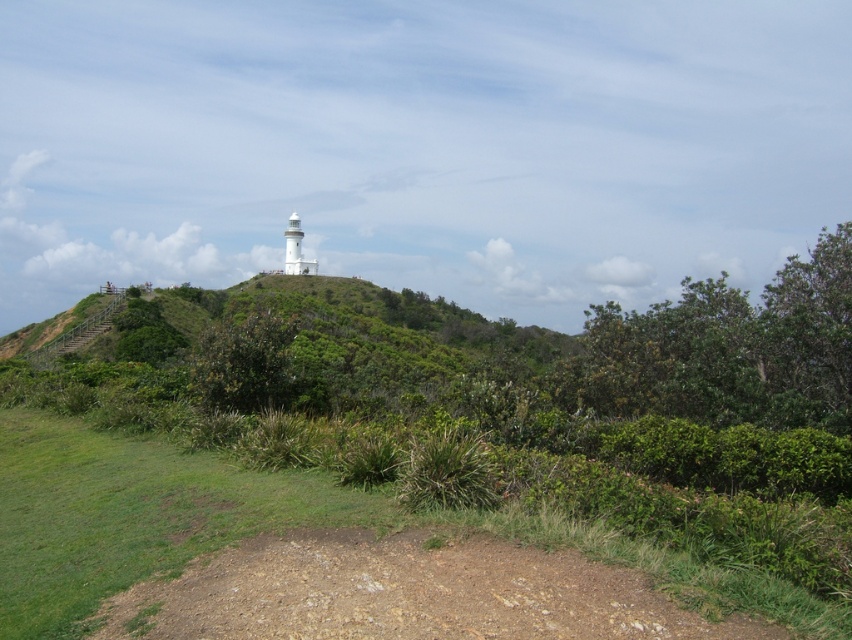
Does dirt/gravel path at lower center have a lesser width compared to green leafy hillside at upper center?

Indeed, dirt/gravel path at lower center has a lesser width compared to green leafy hillside at upper center.

Is point (315, 531) farther from camera compared to point (435, 336)?

No, it is not.

This screenshot has width=852, height=640. I want to click on dirt/gravel path at lower center, so click(x=406, y=593).

Find the location of a particular element. dirt/gravel path at lower center is located at coordinates (406, 593).

Which is in front, point (321, 477) or point (301, 576)?

Point (301, 576) is in front.

Which is behind, point (171, 568) or point (389, 634)?

Positioned behind is point (171, 568).

I want to click on green grassy at lower left, so click(263, 528).

Is point (608, 545) in front of point (147, 348)?

Yes.

Can you confirm if green grassy at lower left is wider than green leafy hillside at upper center?

No.

Who is more forward, (68, 512) or (294, 401)?

Point (68, 512) is in front.

The height and width of the screenshot is (640, 852). I want to click on green grassy at lower left, so click(263, 528).